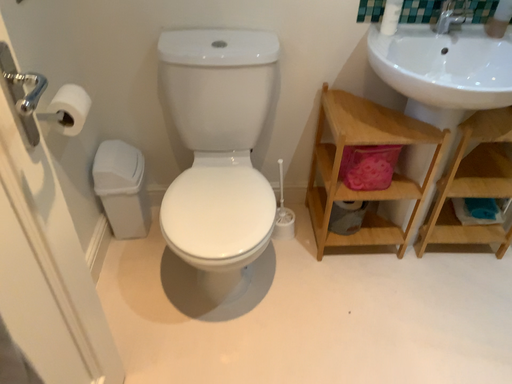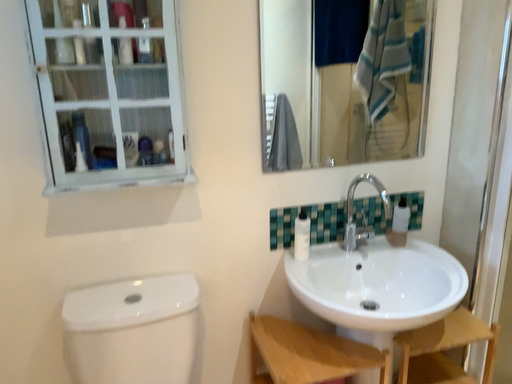
Question: How did the camera likely rotate when shooting the video?

Choices:
 (A) rotated right
 (B) rotated left

Answer: (A)